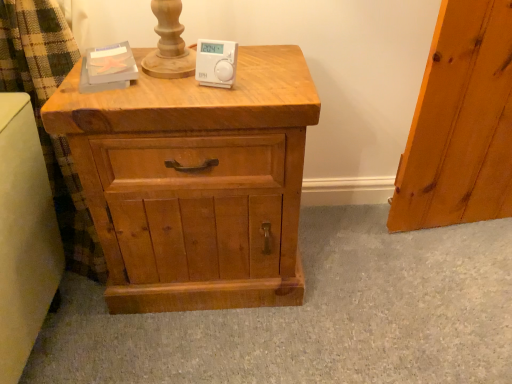
Question: From the image's perspective, is white plastic thermostat at center above natural wood chest of drawers at center?

Choices:
 (A) yes
 (B) no

Answer: (A)

Question: From a real-world perspective, is white plastic thermostat at center below natural wood chest of drawers at center?

Choices:
 (A) yes
 (B) no

Answer: (B)

Question: Can you confirm if white plastic thermostat at center is thinner than natural wood chest of drawers at center?

Choices:
 (A) yes
 (B) no

Answer: (A)

Question: Is white plastic thermostat at center wider than natural wood chest of drawers at center?

Choices:
 (A) yes
 (B) no

Answer: (B)

Question: Is white plastic thermostat at center not within natural wood chest of drawers at center?

Choices:
 (A) yes
 (B) no

Answer: (A)

Question: Is white plastic thermostat at center behind natural wood chest of drawers at center?

Choices:
 (A) no
 (B) yes

Answer: (B)

Question: From a real-world perspective, is natural wood chest of drawers at center positioned over white plastic thermostat at center based on gravity?

Choices:
 (A) no
 (B) yes

Answer: (A)

Question: Are natural wood chest of drawers at center and white plastic thermostat at center located far from each other?

Choices:
 (A) no
 (B) yes

Answer: (A)

Question: Considering the relative sizes of natural wood chest of drawers at center and white plastic thermostat at center in the image provided, is natural wood chest of drawers at center taller than white plastic thermostat at center?

Choices:
 (A) no
 (B) yes

Answer: (B)

Question: Is natural wood chest of drawers at center positioned with its back to white plastic thermostat at center?

Choices:
 (A) yes
 (B) no

Answer: (B)

Question: Considering the relative sizes of natural wood chest of drawers at center and white plastic thermostat at center in the image provided, is natural wood chest of drawers at center smaller than white plastic thermostat at center?

Choices:
 (A) yes
 (B) no

Answer: (B)

Question: Does natural wood chest of drawers at center lie in front of white plastic thermostat at center?

Choices:
 (A) no
 (B) yes

Answer: (B)

Question: From a real-world perspective, is white plastic thermostat at center above or below natural wood chest of drawers at center?

Choices:
 (A) below
 (B) above

Answer: (B)